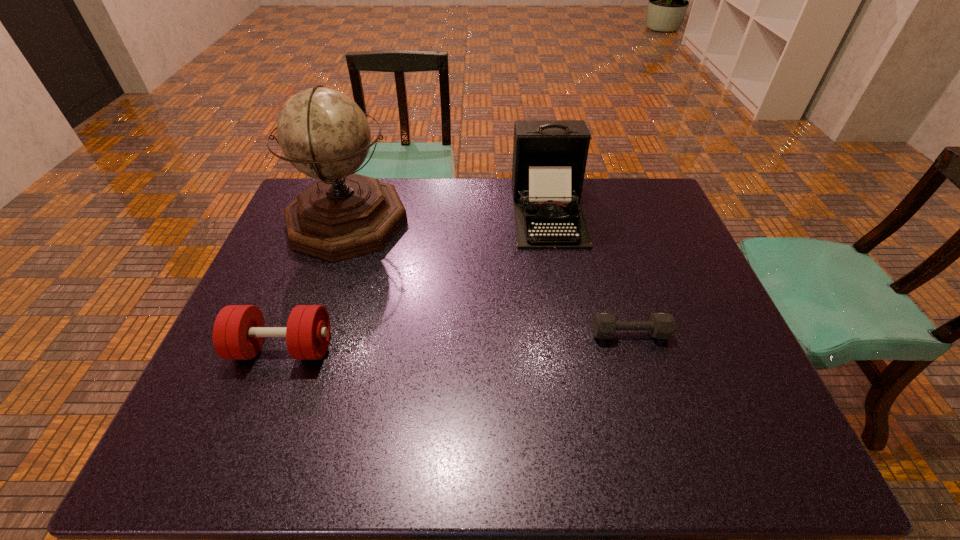
Find the location of a particular element. The height and width of the screenshot is (540, 960). globe is located at coordinates (323, 133).

Identify the location of typewriter. (549, 156).

Identify the location of the left dumbbell. (238, 333).

You are a GUI agent. You are given a task and a screenshot of the screen. Output one action in this format:
    pyautogui.click(x=<x>, y=<y>)
    Task: Click on the taller dumbbell
    Image resolution: width=960 pixels, height=540 pixels.
    Given the screenshot: What is the action you would take?
    pyautogui.click(x=238, y=333)

The height and width of the screenshot is (540, 960). Find the location of `the right dumbbell`. the right dumbbell is located at coordinates (660, 325).

You are a GUI agent. You are given a task and a screenshot of the screen. Output one action in this format:
    pyautogui.click(x=<x>, y=<y>)
    Task: Click on the shortest object
    The width and height of the screenshot is (960, 540).
    Given the screenshot: What is the action you would take?
    pyautogui.click(x=660, y=325)

Find the location of a particular element. This screenshot has width=960, height=540. vacant space located 0.130m on the surface of the globe is located at coordinates (449, 221).

Image resolution: width=960 pixels, height=540 pixels. What are the coordinates of `free space located 0.290m inside the open case of the second tallest object` in the screenshot? It's located at (569, 328).

Where is `free point located 0.250m on the right of the third tallest object`? free point located 0.250m on the right of the third tallest object is located at coordinates (439, 348).

Locate an element on the screen. The image size is (960, 540). free region located 0.200m on the left of the shortest object is located at coordinates (510, 334).